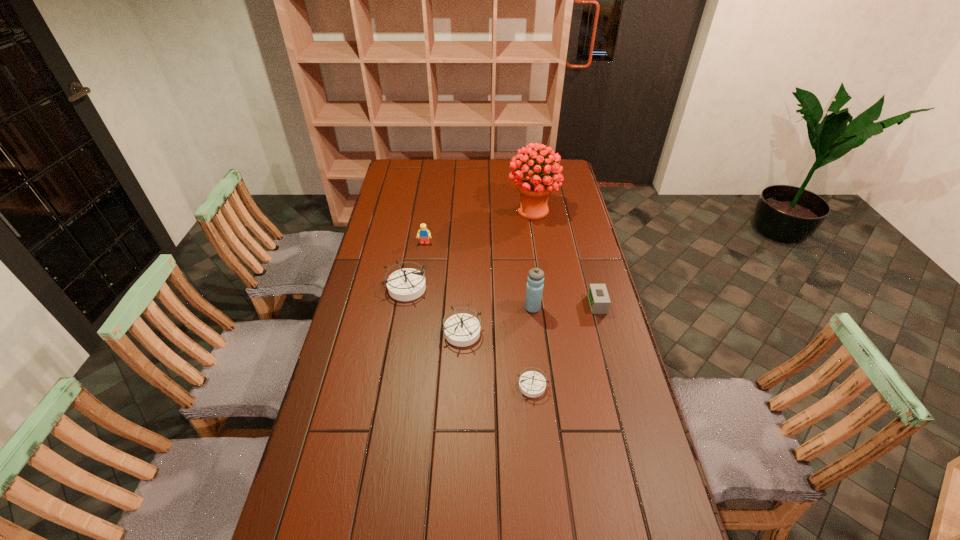
Identify the location of the farthest compass. This screenshot has width=960, height=540. (407, 284).

The image size is (960, 540). In order to click on the sixth farthest object in this screenshot , I will do `click(462, 329)`.

At what (x,y) coordinates should I click in order to perform the action: click on the fifth object from right to left. Please return your answer as a coordinate pair (x, y). Image resolution: width=960 pixels, height=540 pixels. Looking at the image, I should click on (462, 329).

Find the location of `the rightmost compass`. the rightmost compass is located at coordinates (532, 384).

Locate an element on the screen. Image resolution: width=960 pixels, height=540 pixels. the nearest compass is located at coordinates (532, 384).

Identify the location of the farthest object. (534, 188).

Image resolution: width=960 pixels, height=540 pixels. I want to click on bouquet, so click(534, 188).

Where is `the sixth nearest object`? The image size is (960, 540). the sixth nearest object is located at coordinates (424, 234).

Where is `the rightmost object`? This screenshot has width=960, height=540. the rightmost object is located at coordinates (598, 297).

Find the location of a particular element. The width and height of the screenshot is (960, 540). water bottle is located at coordinates (534, 288).